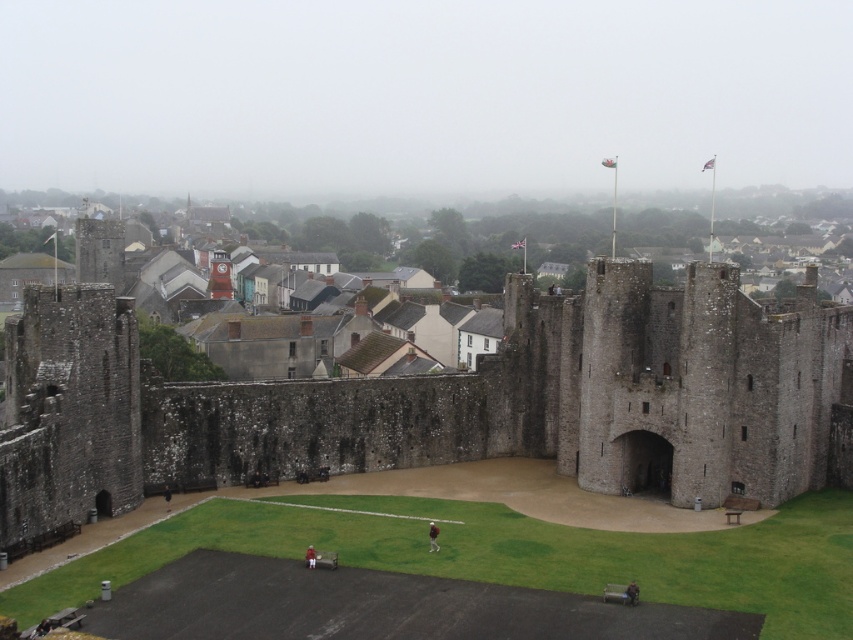
You are a tour guide leading a group through the castle courtyard. You notice two visitors wearing jackets made of fabric. One is wearing a green fabric jacket at lower center and another is wearing a light brown fabric jacket at center. Which jacket is shorter?

The green fabric jacket at lower center is shorter than the light brown fabric jacket at center.

Based on the photo, you are standing in the courtyard of the historic castle and want to take a photo. You notice two points marked in the scene. The first point is at coordinates point [222,269] and the second is at point [631,598]. Which point is closer to you?

Point [222,269] is further to the camera than point [631,598], so the closer point to you is point [631,598].